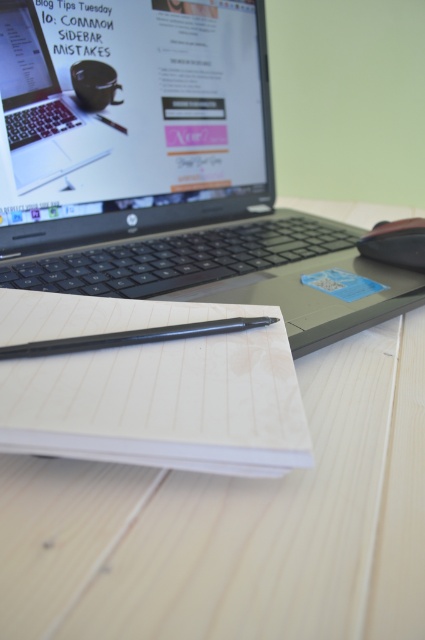
You are organizing your desk and need to move the black plastic laptop at center and the matte black laptop at upper center. Based on their positions, which one should you move first to free up more space?

The black plastic laptop at center should be moved first because it is located below the matte black laptop at upper center, meaning it is closer to the edge of the desk and taking up more space.

You need to place a new keyboard that is 12 inches wide on your desk. Given the current setup with the black plastic laptop at center and the matte black laptop at upper center, which laptop should you move to make space for the keyboard?

The black plastic laptop at center should be moved to make space for the keyboard since it has a larger size compared to the matte black laptop at upper center, allowing for more space to accommodate the keyboard.